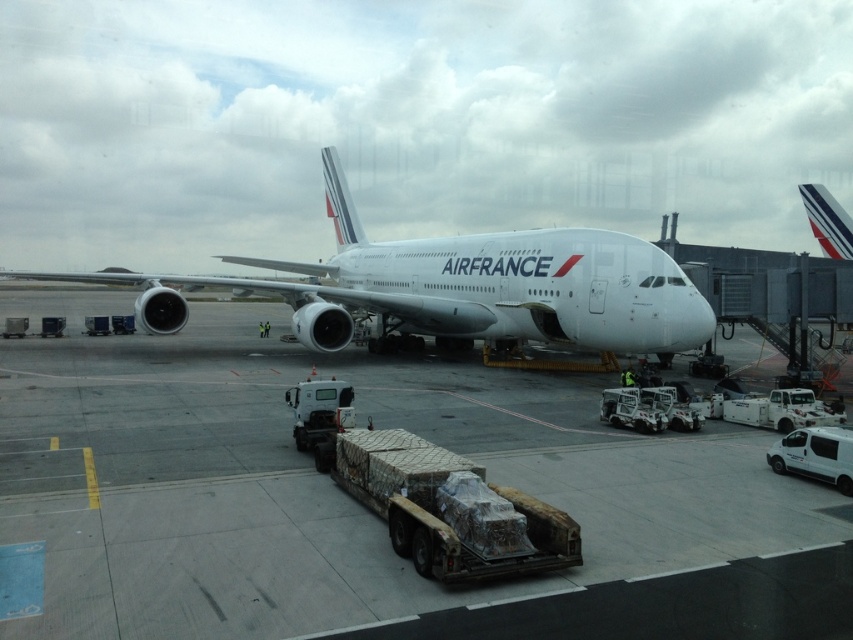
You are a pilot who just landed the white glossy airplane at upper center. You need to taxi to the white concrete tarmac at center. Can you safely maneuver the airplane onto the tarmac?

The white concrete tarmac at center occupies less space than the white glossy airplane at upper center, so it may not be large enough to accommodate the airplane safely. You should choose a larger tarmac area.

Looking at this image, you are a pilot standing at the cockpit of the Air France Airbus A380. You notice two points marked on the tarmac outside your window. The first point is at coordinate point(x=577, y=268) and the second point is at coordinate point(x=821, y=221). Based on your position in the cockpit, which point is closer to the aircraft?

Point(x=577, y=268) is in front of point(x=821, y=221), so the first point is closer to the aircraft.